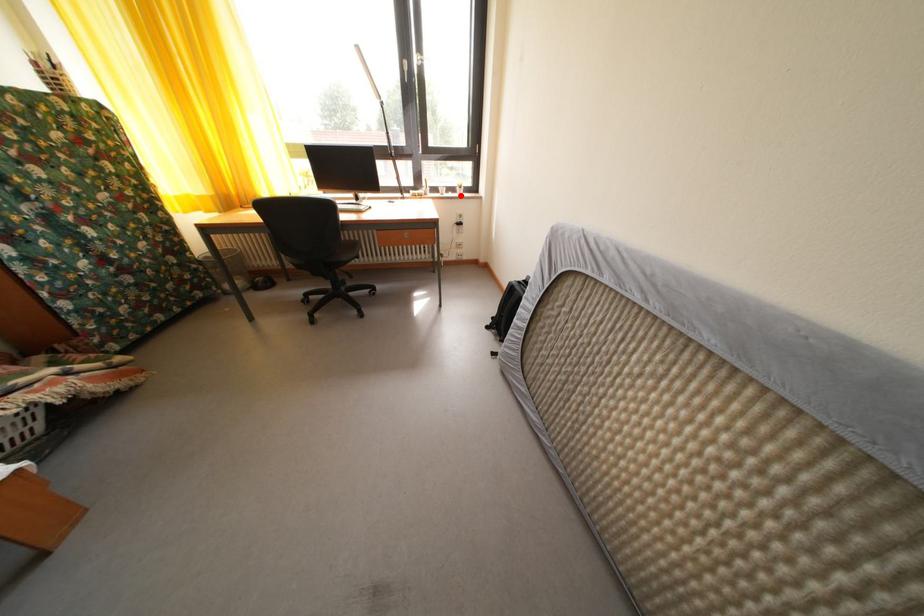
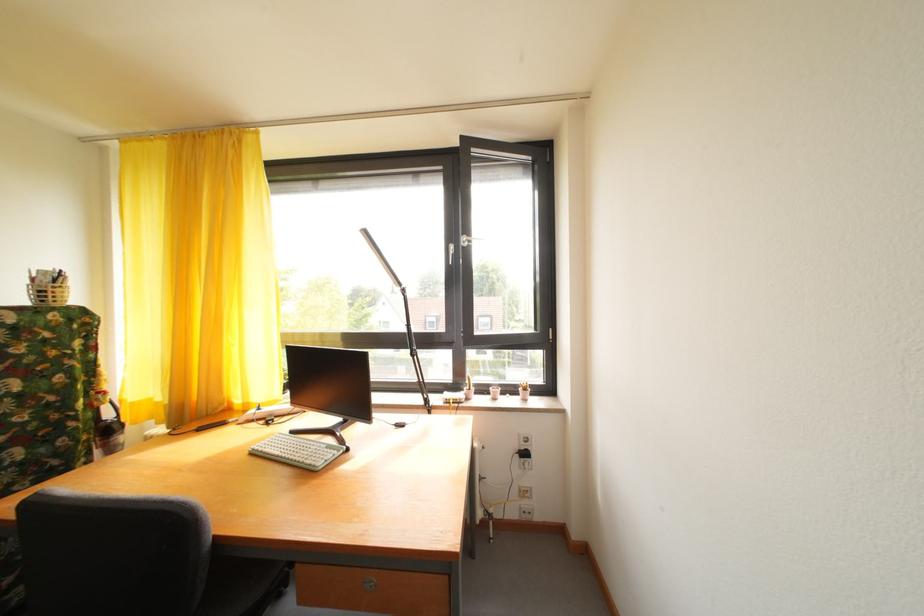
Question: I am providing you with two images of the same scene from different viewpoints. In image1, a red point is highlighted. Considering the same 3D point in image2, which of the following is correct?

Choices:
 (A) It is closer
 (B) It is farther

Answer: (B)